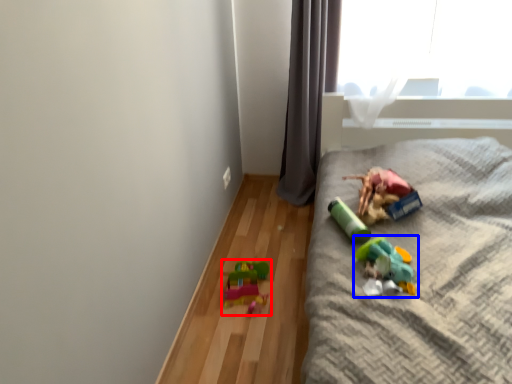
Question: Which object is closer to the camera taking this photo, toy (highlighted by a red box) or toy (highlighted by a blue box)?

Choices:
 (A) toy
 (B) toy

Answer: (B)